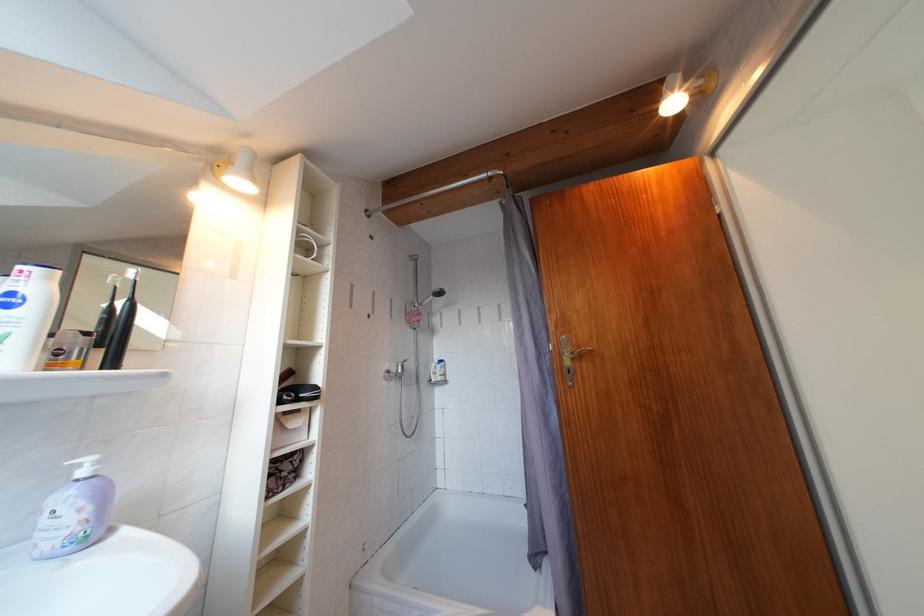
At what (x,y) coordinates should I click in order to perform the action: click on white lotion bottle. Please return your answer as a coordinate pair (x, y). Image resolution: width=924 pixels, height=616 pixels. Looking at the image, I should click on (74, 513).